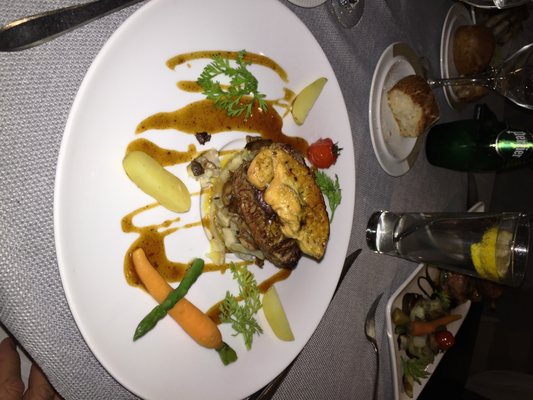
The image size is (533, 400). Find the location of `glass`. glass is located at coordinates click(441, 246).